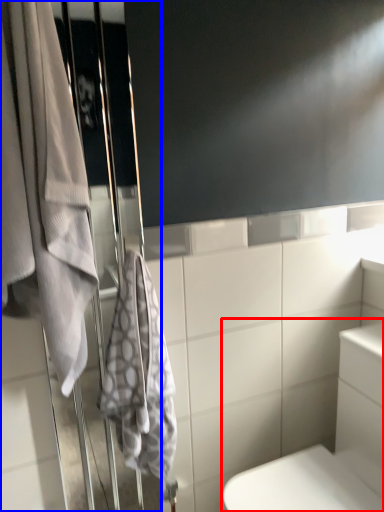
Question: Which object appears farthest to the camera in this image, bath (highlighted by a red box) or screen door (highlighted by a blue box)?

Choices:
 (A) bath
 (B) screen door

Answer: (B)